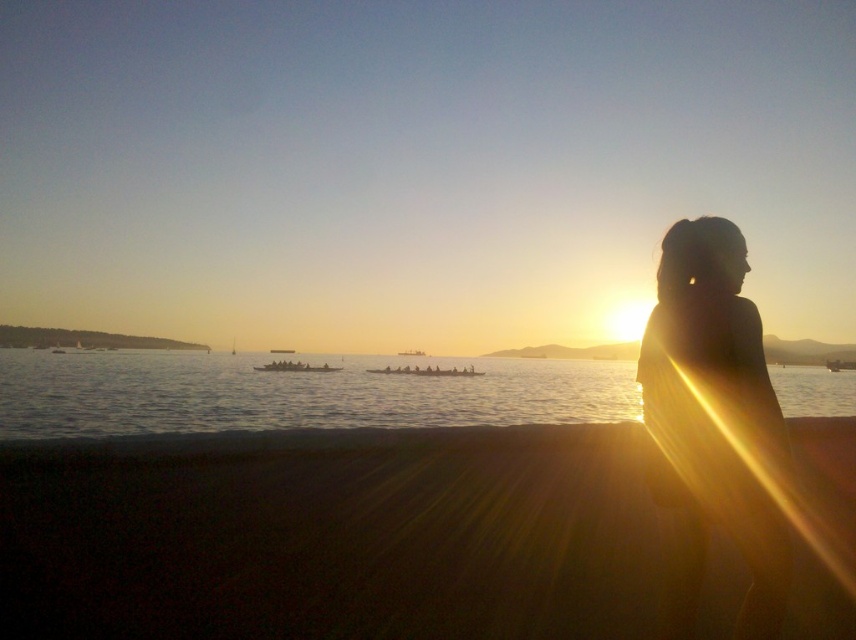
You are standing on the dark sand at lower center and want to reach the silvery water at center. Which direction should you move to get there?

The dark sand at lower center is positioned over silvery water at center, so you should move downward to reach the silvery water at center.

You are a photographer trying to capture the sunset scene. You notice the dark sand at lower center and the silhouette hair at right. Which object is wider in the image?

The dark sand at lower center might be wider than silhouette hair at right according to the description.